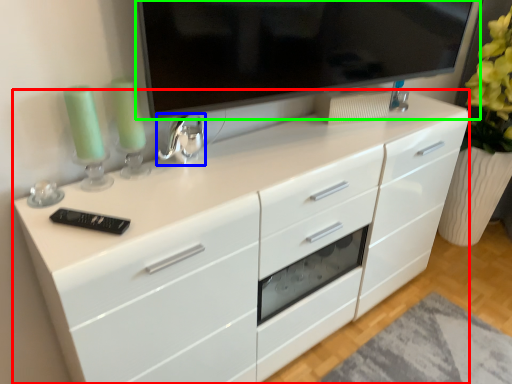
Question: Estimate the real-world distances between objects in this image. Which object is closer to chest of drawers (highlighted by a red box), appliance (highlighted by a blue box) or television (highlighted by a green box)?

Choices:
 (A) appliance
 (B) television

Answer: (B)